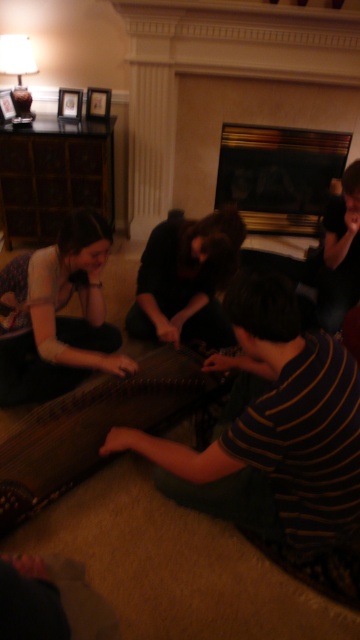
You are standing in the room and want to pick up the matte black dress at lower left and the dark brown leather jacket at upper right. Which item can you reach without moving from your current position?

The matte black dress at lower left is closer to the viewer than the dark brown leather jacket at upper right, so you can reach the matte black dress at lower left without moving, but you might need to move to reach the dark brown leather jacket at upper right.

You are planning to move the wooden harp at center and the matte black dress at lower left to a narrower space. Which object might be harder to move due to its size?

The wooden harp at center has a greater width than the matte black dress at lower left, so it might be harder to move due to its larger size.

You are a photographer standing in the room and want to capture a photo that includes both the matte black dress at lower left and the dark brown leather guitar at center. Based on their positions, which object should you focus on first to ensure both are in the frame?

The matte black dress at lower left is located below the dark brown leather guitar at center, so you should focus on the dark brown leather guitar at center first to ensure both are in the frame.